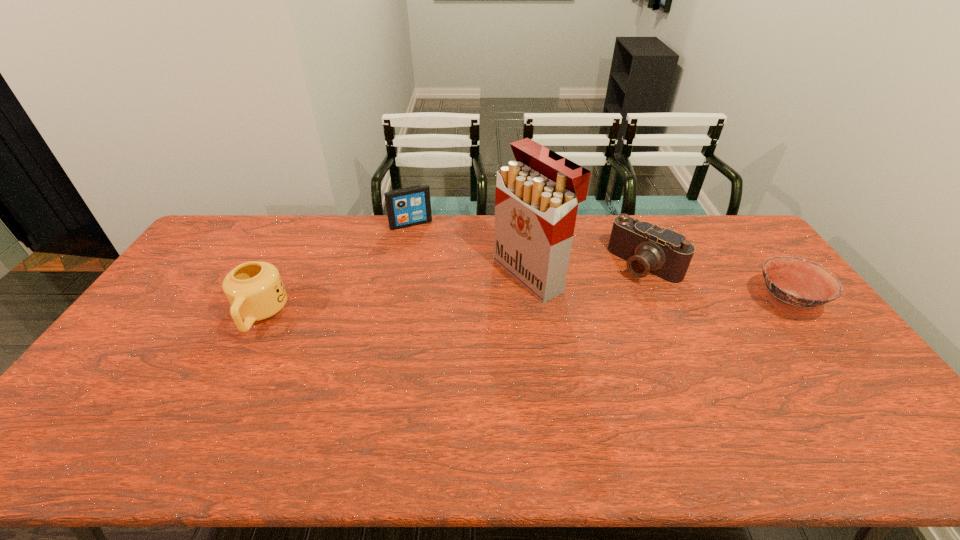
You are a GUI agent. You are given a task and a screenshot of the screen. Output one action in this format:
    pyautogui.click(x=<x>, y=<y>)
    Task: Click on the free space located 0.180m on the front-facing side of the camera
    This screenshot has height=540, width=960.
    Given the screenshot: What is the action you would take?
    pyautogui.click(x=598, y=309)

Locate an element on the screen. This screenshot has width=960, height=540. vacant region located on the front-facing side of the camera is located at coordinates (581, 325).

Where is `vacant space positioned on the front-facing side of the camera`? The height and width of the screenshot is (540, 960). vacant space positioned on the front-facing side of the camera is located at coordinates (604, 304).

Locate an element on the screen. vacant space located with the lid open on the cigarette case is located at coordinates (448, 317).

You are a GUI agent. You are given a task and a screenshot of the screen. Output one action in this format:
    pyautogui.click(x=<x>, y=<y>)
    Task: Click on the vacant space located 0.160m with the lid open on the cigarette case
    
    Given the screenshot: What is the action you would take?
    click(460, 312)

I want to click on vacant space situated 0.320m with the lid open on the cigarette case, so click(x=413, y=334).

You are a GUI agent. You are given a task and a screenshot of the screen. Output one action in this format:
    pyautogui.click(x=<x>, y=<y>)
    Task: Click on the vacant point located 0.160m on the front screen of the second object from left to right
    
    Given the screenshot: What is the action you would take?
    pyautogui.click(x=430, y=254)

This screenshot has width=960, height=540. In order to click on vacant space located on the front screen of the second object from left to right in this screenshot , I will do `click(434, 263)`.

Locate an element on the screen. free space located 0.180m on the front screen of the second object from left to right is located at coordinates (432, 258).

This screenshot has width=960, height=540. Find the location of `camera that is at the far edge`. camera that is at the far edge is located at coordinates tap(647, 248).